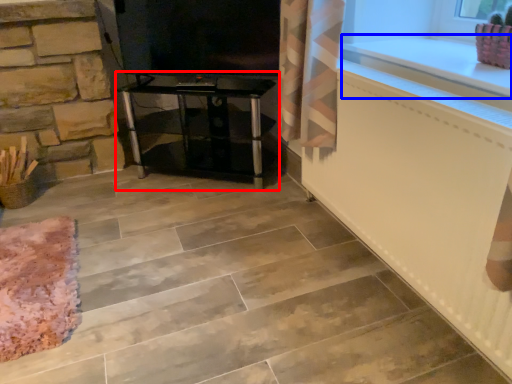
Question: Among these objects, which one is farthest to the camera, furniture (highlighted by a red box) or counter top (highlighted by a blue box)?

Choices:
 (A) furniture
 (B) counter top

Answer: (A)